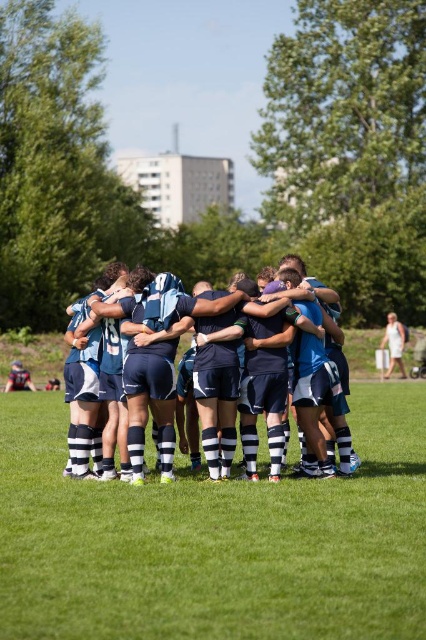
Measure the distance between green grass at center and blue jersey at center.

A distance of 2.75 meters exists between green grass at center and blue jersey at center.

Find the location of `green grass at center`. green grass at center is located at coordinates (215, 540).

Between point (164, 524) and point (224, 408), which one is positioned behind?

The point (224, 408) is behind.

What are the coordinates of `green grass at center` in the screenshot? It's located at (215, 540).